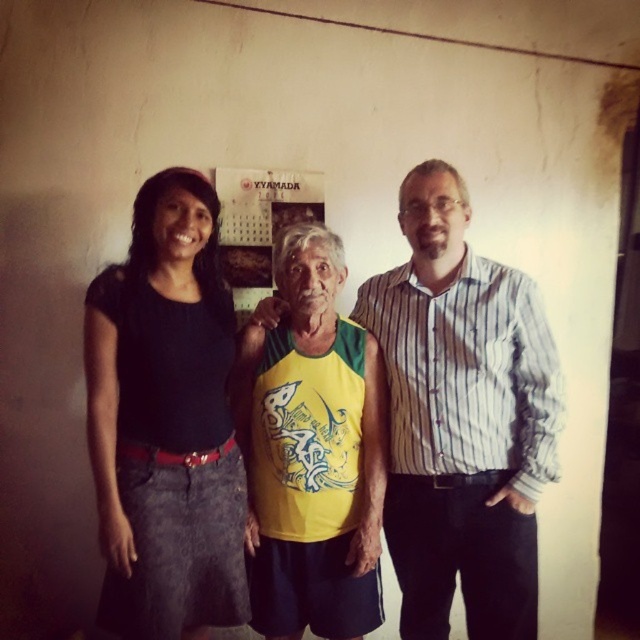
You are a photographer trying to adjust the composition of the image. Which object, the striped cotton shirt at center or the black denim skirt at left, is positioned lower in the frame?

The striped cotton shirt at center is located below the black denim skirt at left, so it is positioned lower in the frame.